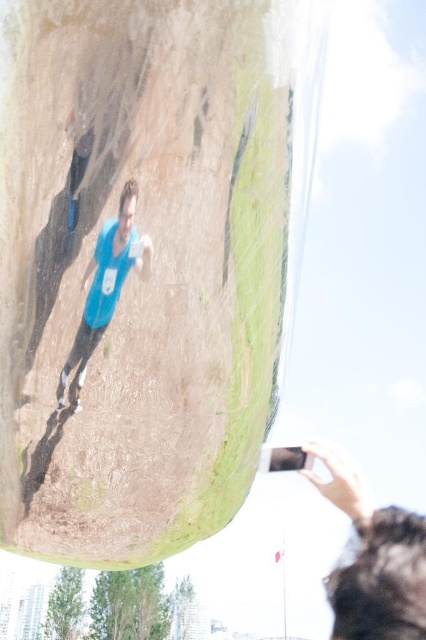
Question: Which point is closer to the camera?

Choices:
 (A) blue fabric shirt at center
 (B) blue fabric shirt at lower right
 (C) transparent plastic bubble at center

Answer: (C)

Question: Can you confirm if transparent plastic bubble at center is positioned to the left of blue fabric shirt at lower right?

Choices:
 (A) yes
 (B) no

Answer: (A)

Question: Which is farther from the blue fabric shirt at center?

Choices:
 (A) transparent plastic bubble at center
 (B) blue fabric shirt at lower right

Answer: (B)

Question: Which point is farther to the camera?

Choices:
 (A) transparent plastic bubble at center
 (B) blue fabric shirt at lower right

Answer: (B)

Question: Does transparent plastic bubble at center have a lesser width compared to blue fabric shirt at center?

Choices:
 (A) yes
 (B) no

Answer: (B)

Question: Does blue fabric shirt at lower right have a greater width compared to blue fabric shirt at center?

Choices:
 (A) no
 (B) yes

Answer: (B)